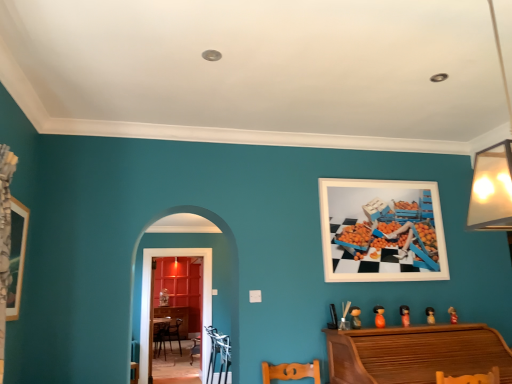
You are a GUI agent. You are given a task and a screenshot of the screen. Output one action in this format:
    pyautogui.click(x=<x>, y=<y>)
    Task: Click on the vacant area that is in front of matte wooden doll at lower center, arranged as the 5th toy when viewed from the right
    The image size is (512, 384).
    Given the screenshot: What is the action you would take?
    pyautogui.click(x=354, y=330)